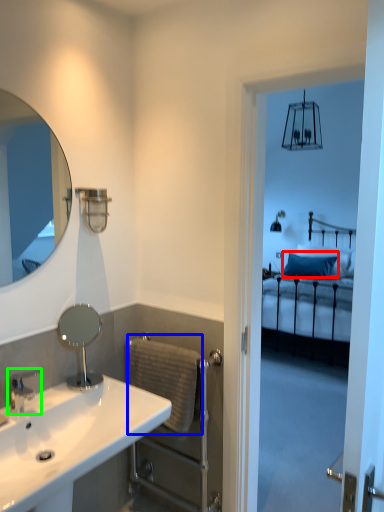
Question: Considering the real-world distances, which object is farthest from pillow (highlighted by a red box)? towel bar (highlighted by a blue box) or tap (highlighted by a green box)?

Choices:
 (A) towel bar
 (B) tap

Answer: (B)